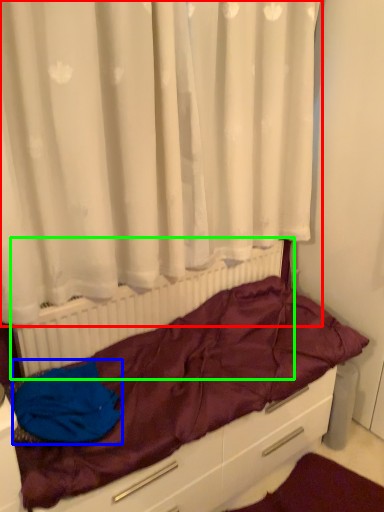
Question: Which object is the farthest from curtain (highlighted by a red box)? Choose among these: material (highlighted by a blue box) or radiator (highlighted by a green box).

Choices:
 (A) material
 (B) radiator

Answer: (A)